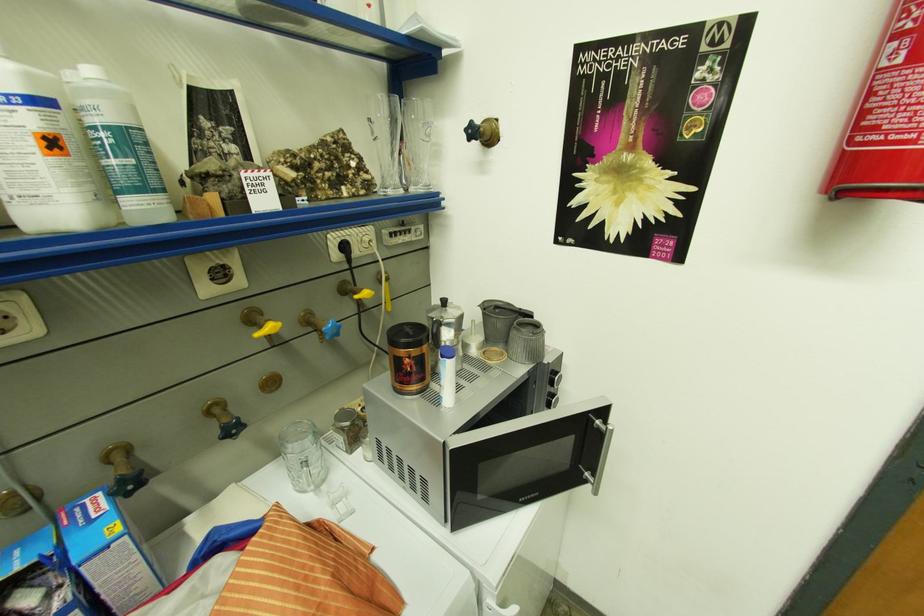
Where would you lift the blue cardboard box? Please return your answer as a coordinate pair (x, y).

(49, 578)